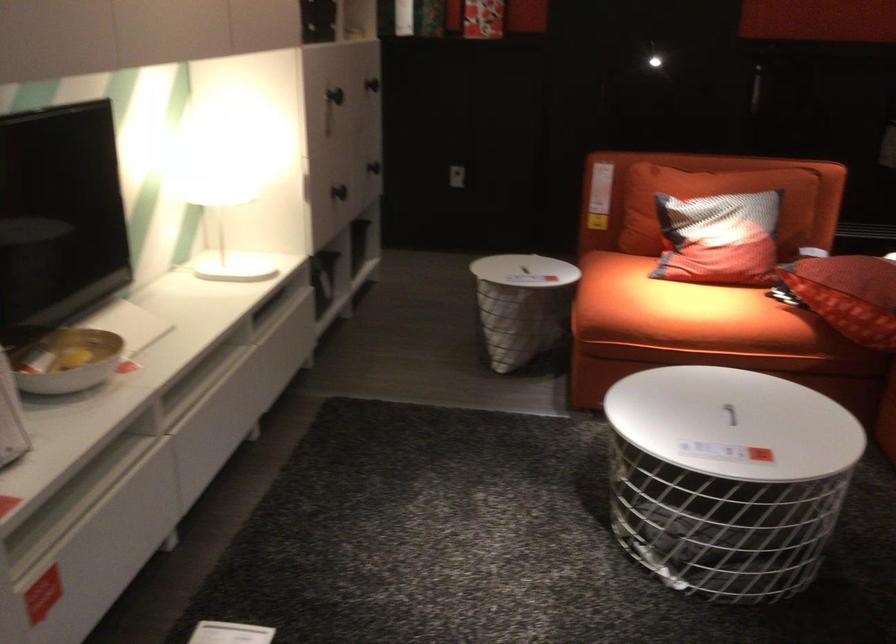
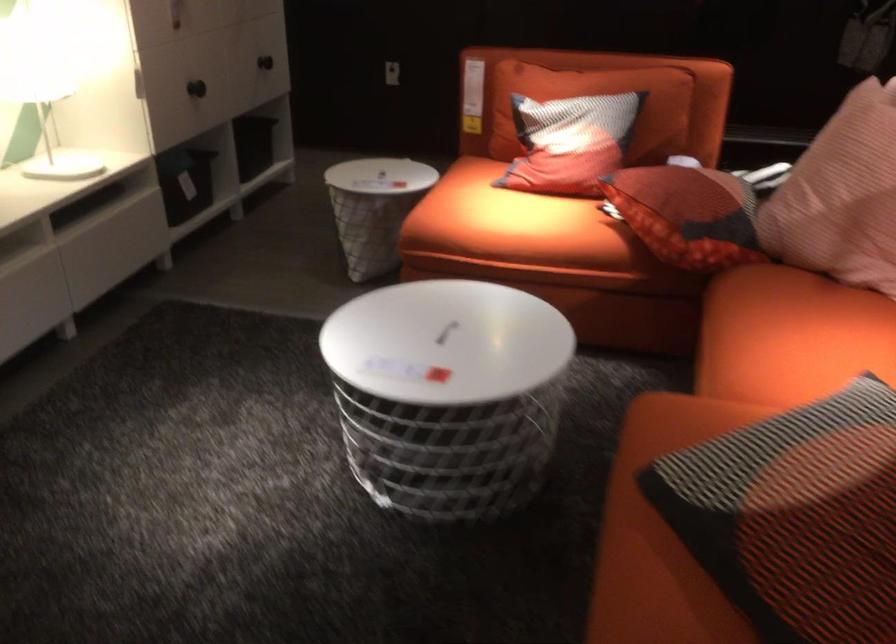
Question: Which direction would the cameraman need to move to produce the second image? Reply with the corresponding letter.

Choices:
 (A) Left
 (B) Right
 (C) Forward
 (D) Backward

Answer: (B)